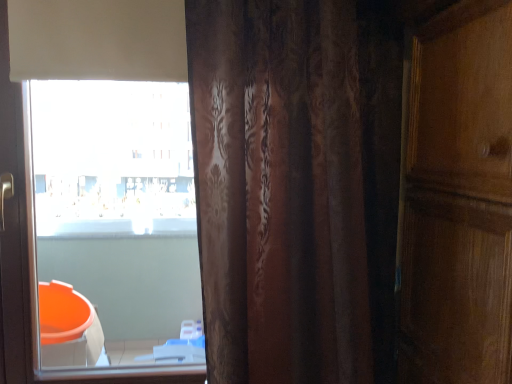
Question: From the image's perspective, is white matte window at upper left located above or below brown textured curtain at center?

Choices:
 (A) above
 (B) below

Answer: (A)

Question: Is white matte window at upper left situated inside brown textured curtain at center or outside?

Choices:
 (A) outside
 (B) inside

Answer: (A)

Question: Is point (19, 208) positioned closer to the camera than point (281, 160)?

Choices:
 (A) closer
 (B) farther

Answer: (B)

Question: Considering their positions, is brown textured curtain at center located in front of or behind white matte window at upper left?

Choices:
 (A) behind
 (B) front

Answer: (B)

Question: From their relative heights in the image, would you say brown textured curtain at center is taller or shorter than white matte window at upper left?

Choices:
 (A) short
 (B) tall

Answer: (A)

Question: Considering the positions of brown textured curtain at center and white matte window at upper left in the image, is brown textured curtain at center wider or thinner than white matte window at upper left?

Choices:
 (A) thin
 (B) wide

Answer: (B)

Question: Is brown textured curtain at center situated inside white matte window at upper left or outside?

Choices:
 (A) inside
 (B) outside

Answer: (B)